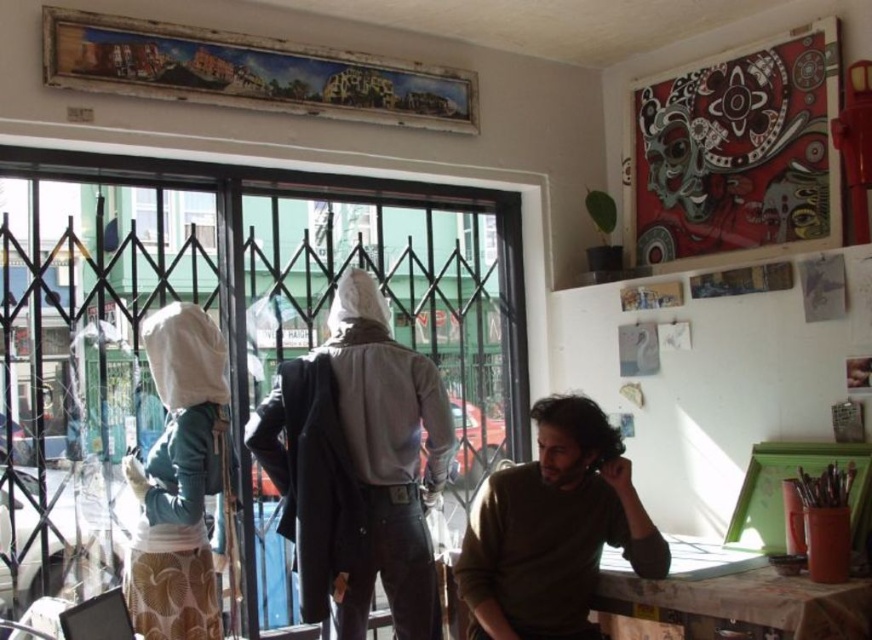
You are a customer in the cafe and want to place both the brown sweater at center and the white fabric bag at left on a shelf. The shelf has limited space. Which item should you place first to maximize the shelf space?

Since the brown sweater at center occupies less space than the white fabric bag at left, you should place the brown sweater at center first to leave more room for the larger white fabric bag at left.

You are a customer in the cafe and want to choose between the matte white hoodie at center and the brown sweater at center. Which one is closer to the window with metal security bars?

The matte white hoodie at center is closer to the window with metal security bars because it is positioned to the left of the brown sweater at center, and the window is on the left side of the image.